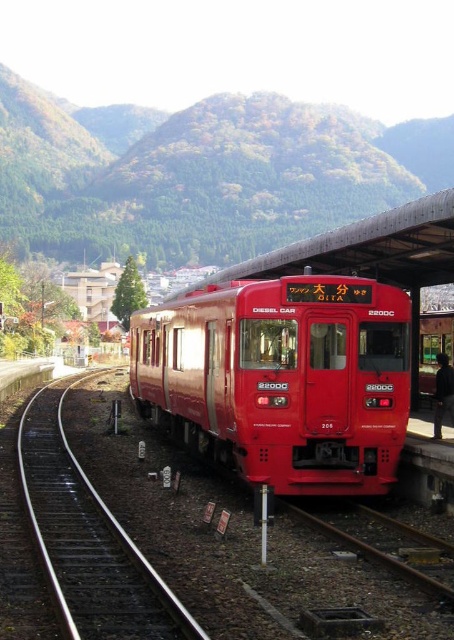
Question: Can you confirm if shiny red train at center is bigger than metal/smooth track at lower left?

Choices:
 (A) yes
 (B) no

Answer: (A)

Question: Does shiny red train at center appear on the left side of metal/smooth track at lower left?

Choices:
 (A) yes
 (B) no

Answer: (B)

Question: Which object appears farthest from the camera in this image?

Choices:
 (A) shiny red train at center
 (B) metal/smooth track at lower left

Answer: (A)

Question: Is shiny red train at center positioned behind metal/smooth track at lower left?

Choices:
 (A) yes
 (B) no

Answer: (A)